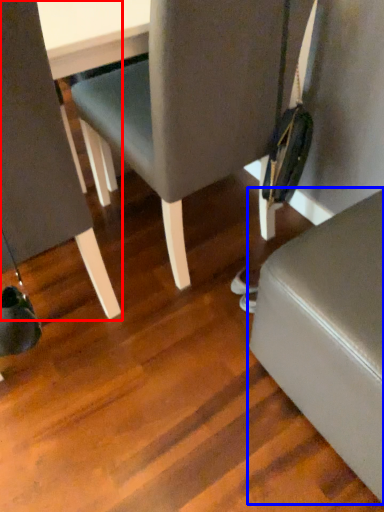
Question: Which object appears farthest to the camera in this image, chair (highlighted by a red box) or furniture (highlighted by a blue box)?

Choices:
 (A) chair
 (B) furniture

Answer: (B)